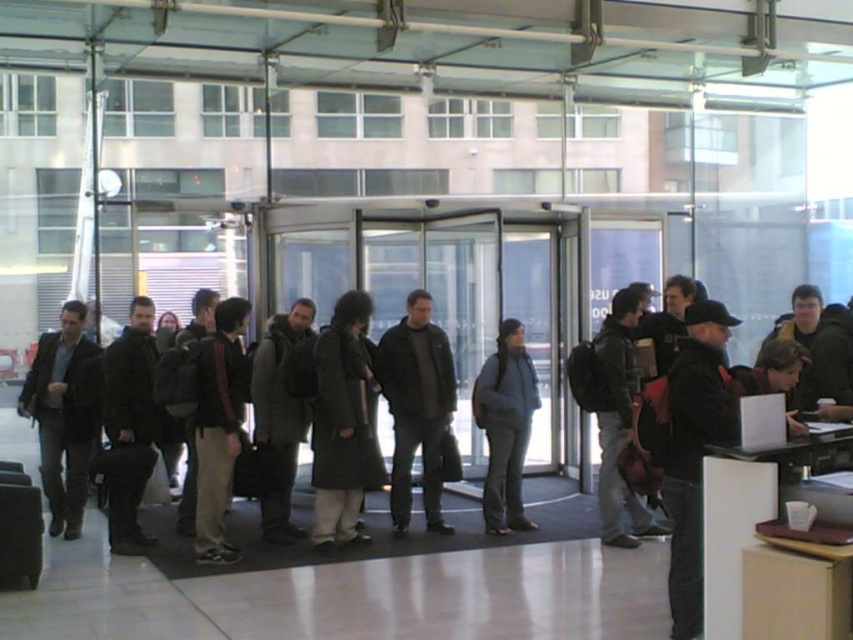
Does dark gray leather jacket at center appear on the right side of blue fabric jacket at center?

Answer: Incorrect, dark gray leather jacket at center is not on the right side of blue fabric jacket at center.

Is dark gray leather jacket at center taller than blue fabric jacket at center?

Yes.

What do you see at coordinates (416, 406) in the screenshot?
I see `dark gray leather jacket at center` at bounding box center [416, 406].

Identify the location of dark gray leather jacket at center. (416, 406).

This screenshot has height=640, width=853. Describe the element at coordinates (341, 422) in the screenshot. I see `dark gray coat at center` at that location.

Which of these two, dark gray coat at center or black matte jacket at left, stands shorter?

With less height is black matte jacket at left.

Describe the element at coordinates (341, 422) in the screenshot. This screenshot has width=853, height=640. I see `dark gray coat at center` at that location.

Identify the location of dark gray coat at center. (341, 422).

Between black matte jacket at left and dark brown leather jacket at center, which one appears on the right side from the viewer's perspective?

dark brown leather jacket at center is more to the right.

Is black matte jacket at left thinner than dark brown leather jacket at center?

Indeed, black matte jacket at left has a lesser width compared to dark brown leather jacket at center.

The height and width of the screenshot is (640, 853). I want to click on black matte jacket at left, so click(129, 426).